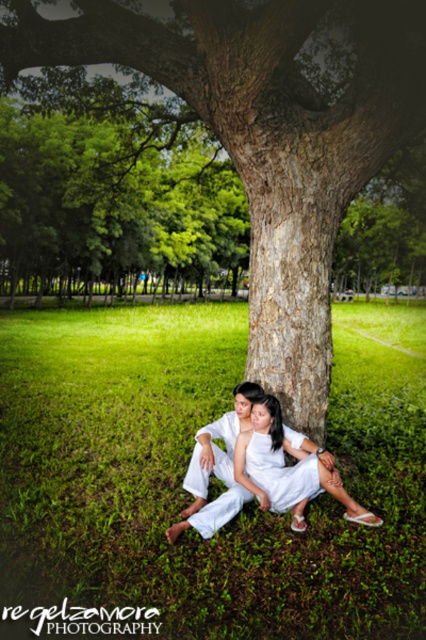
You are a photographer trying to capture a photo of the white satin dress at center and the green grass at lower center. You want to ensure that both subjects are visible in the frame. Based on their positions, which object should be placed to the left side of the other?

The green grass at lower center is positioned on the left side of white satin dress at center, so the green grass at lower center should be placed to the left of the white satin dress at center to ensure both are visible.

You are standing at the point marked as point (186, 468) in the image. Looking around, you see the large tree dominating the upper part of the scene and the two individuals seated on the grass. What is directly beneath your feet at this point?

The point (186, 468) corresponds to green grass at lower center, so directly beneath your feet is the green grass at lower center.

You are a photographer planning to capture a closeup shot of the green grass at lower center. However, you want to ensure that the white satin dress at center is still visible in the background. Given their heights, is this possible?

The green grass at lower center is taller than the white satin dress at center. Since the grass is taller, the dress may be partially obscured unless the camera angle is adjusted to include both.